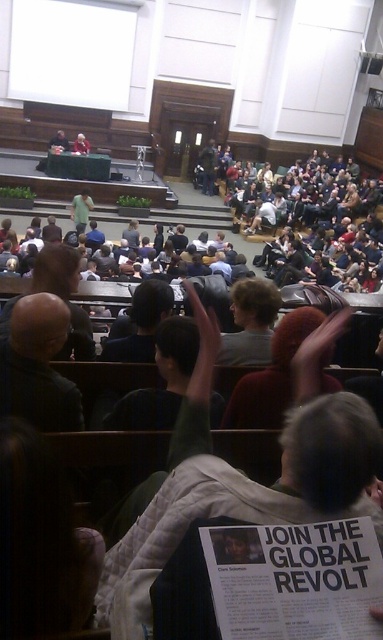
Between bald head at left and light gray sweater at center, which one is positioned lower?

bald head at left is lower down.

Does bald head at left have a lesser height compared to light gray sweater at center?

Indeed, bald head at left has a lesser height compared to light gray sweater at center.

Which is in front, point (57, 344) or point (80, 221)?

Point (57, 344) is in front.

Where is `bald head at left`? The image size is (383, 640). bald head at left is located at coordinates (37, 365).